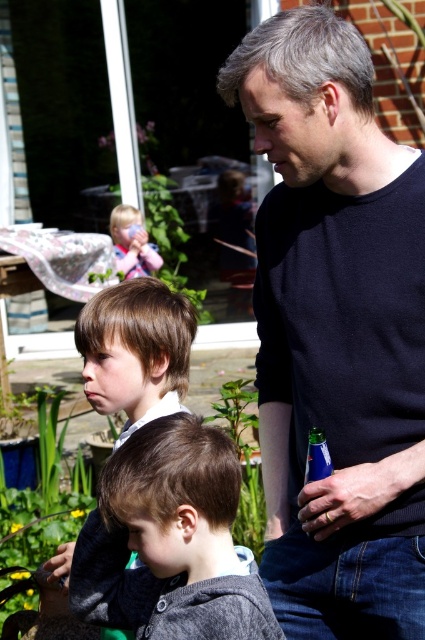
Question: Does dark blue sweater at center appear over dark gray sweater at lower center?

Choices:
 (A) yes
 (B) no

Answer: (A)

Question: Is dark blue sweater at center positioned at the back of green leafy plant at center?

Choices:
 (A) no
 (B) yes

Answer: (A)

Question: Does dark blue sweater at center have a greater width compared to green leafy plant at center?

Choices:
 (A) no
 (B) yes

Answer: (B)

Question: Which point appears farthest from the camera in this image?

Choices:
 (A) (251, 524)
 (B) (141, 419)

Answer: (A)

Question: Based on their relative distances, which object is farther from the matte pink toy at center?

Choices:
 (A) dark gray sweater at lower center
 (B) green leafy plant at center

Answer: (A)

Question: Which of the following is the farthest from the observer?

Choices:
 (A) (167, 182)
 (B) (141, 269)
 (C) (246, 483)

Answer: (A)